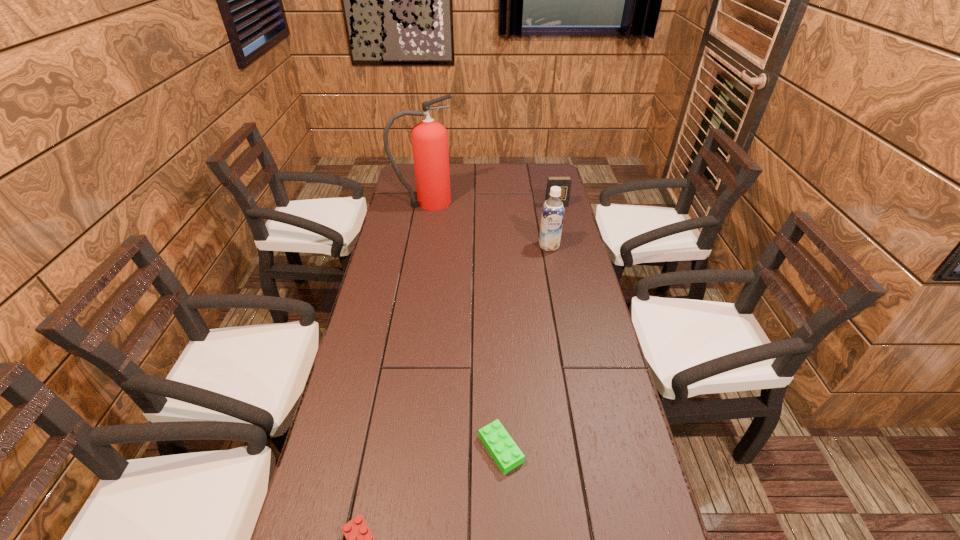
Locate an element on the screen. The height and width of the screenshot is (540, 960). object that is at the left edge is located at coordinates (429, 138).

Where is `soya milk that is positioned at the right edge`? This screenshot has width=960, height=540. soya milk that is positioned at the right edge is located at coordinates (552, 216).

Find the location of a particular element. The height and width of the screenshot is (540, 960). diary present at the right edge is located at coordinates (564, 182).

Locate an element on the screen. free space at the far edge of the desktop is located at coordinates (457, 166).

Image resolution: width=960 pixels, height=540 pixels. In the image, there is a desktop. In order to click on vacant area at the left edge in this screenshot , I will do `click(350, 503)`.

In the image, there is a desktop. Identify the location of vacant space at the right edge. (567, 368).

In order to click on vacant area at the far left corner in this screenshot , I will do `click(410, 184)`.

At what (x,y) coordinates should I click in order to perform the action: click on vacant space that's between the fire extinguisher and the third nearest object. Please return your answer as a coordinate pair (x, y). Looking at the image, I should click on (487, 224).

Locate an element on the screen. free area in between the right Lego and the fourth shortest object is located at coordinates (525, 347).

The image size is (960, 540). What are the coordinates of `unoccupied position between the second tallest object and the farther Lego` in the screenshot? It's located at (525, 347).